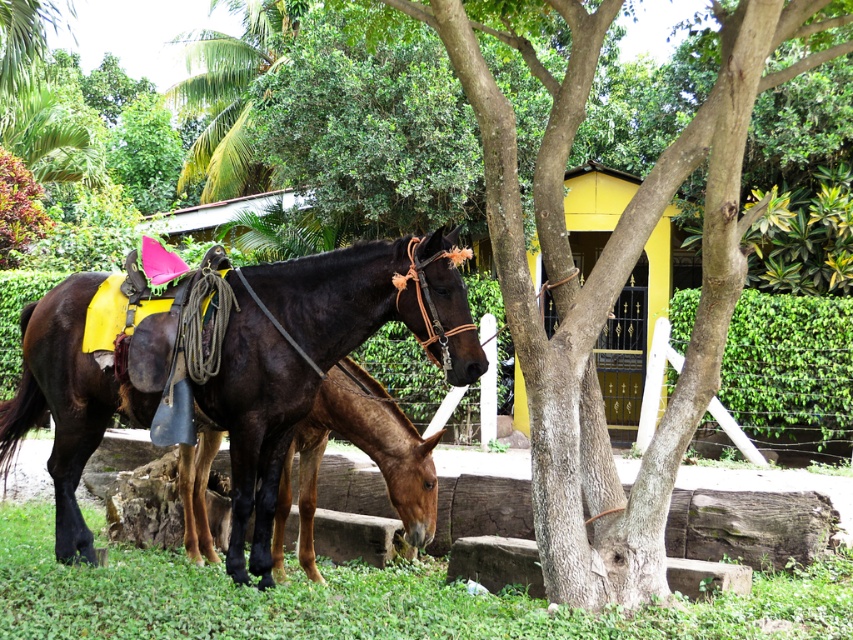
You are a photographer positioned at the origin point of the image. You want to capture a photo of the shiny dark brown horse at center. What are the coordinates of the horse in the image?

The coordinates of the shiny dark brown horse at center are at point (314, 356).

You are a photographer positioned at the front of the scene. You want to take a photo of both the shiny dark brown horse at center and the brown glossy horse at center. Which horse should you focus on first to ensure both are in the frame?

The shiny dark brown horse at center is in front of the brown glossy horse at center, so you should focus on the shiny dark brown horse at center first to ensure both are in the frame.